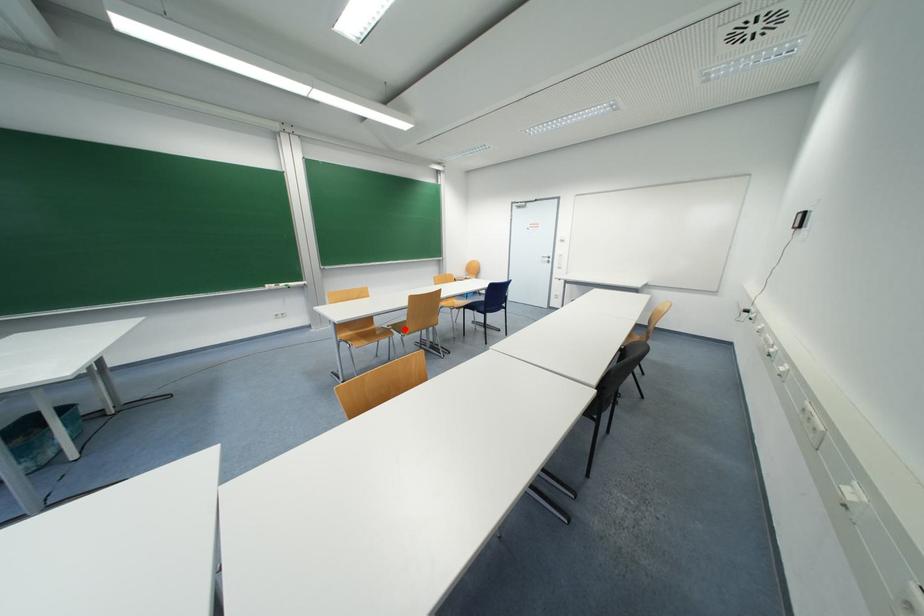
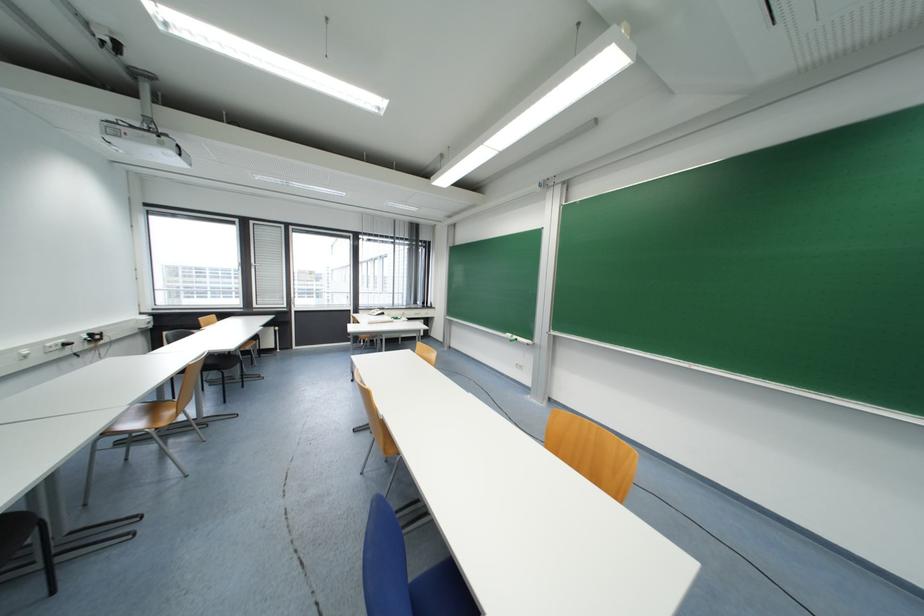
Question: I am providing you with two images of the same scene from different viewpoints. A red point is marked on the first image. Is the red point's position out of view in image 2?

Choices:
 (A) Yes
 (B) No

Answer: (A)